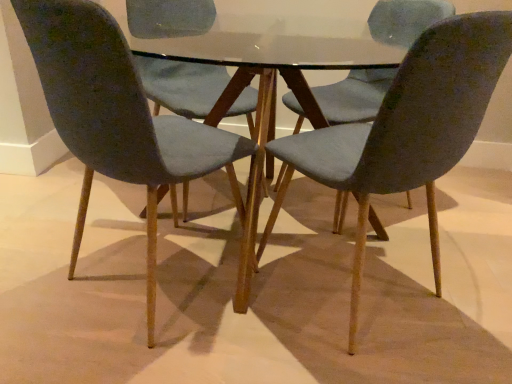
At what (x,y) coordinates should I click in order to perform the action: click on vacant space that is in between glass table at center and matte gray chair at left, which appears as the 3th chair when viewed from the right. Please return your answer as a coordinate pair (x, y). The width and height of the screenshot is (512, 384). Looking at the image, I should click on (207, 316).